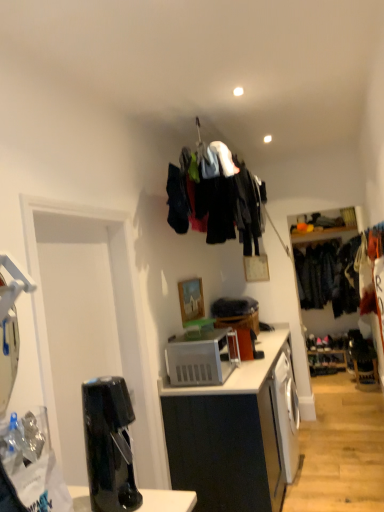
What do you see at coordinates (109, 445) in the screenshot?
I see `black glossy coffee machine at lower left` at bounding box center [109, 445].

At what (x,y) coordinates should I click in order to perform the action: click on black glossy coffee machine at lower left. Please return your answer as a coordinate pair (x, y). The height and width of the screenshot is (512, 384). Looking at the image, I should click on (109, 445).

At what (x,y) coordinates should I click in order to perform the action: click on wooden picture frame at center. Please return your answer as a coordinate pair (x, y). Image resolution: width=384 pixels, height=512 pixels. Looking at the image, I should click on (191, 298).

Describe the element at coordinates (236, 433) in the screenshot. I see `white matte cabinet at center` at that location.

Measure the distance between point (307, 267) and camera.

Point (307, 267) is 5.72 meters from camera.

What do you see at coordinates (215, 200) in the screenshot? I see `dark fabric clothes at upper center, placed as the 1th clothing when sorted from left to right` at bounding box center [215, 200].

Find the location of a particular element. This screenshot has height=512, width=384. white plastic microwave oven at center is located at coordinates (198, 358).

From the image's perspective, between wooden picture frame at center and white matte cabinet at center, who is located below?

white matte cabinet at center, from the image's perspective.

How different are the orientations of wooden picture frame at center and white matte cabinet at center in degrees?

There is a 0.329-degree angle between the facing directions of wooden picture frame at center and white matte cabinet at center.

Based on the photo, is wooden picture frame at center oriented towards white matte cabinet at center?

No, wooden picture frame at center is not turned towards white matte cabinet at center.

Considering the sizes of objects wooden picture frame at center and white matte cabinet at center in the image provided, who is wider, wooden picture frame at center or white matte cabinet at center?

Wider between the two is white matte cabinet at center.

Which is in front, white plastic microwave oven at center or wooden picture frame at center?

Positioned in front is white plastic microwave oven at center.

Where is `microwave oven in front of the wooden picture frame at center`? microwave oven in front of the wooden picture frame at center is located at coordinates (198, 358).

Based on their sizes in the image, would you say white plastic microwave oven at center is bigger or smaller than wooden picture frame at center?

white plastic microwave oven at center is bigger than wooden picture frame at center.

How much distance is there between white plastic microwave oven at center and wooden picture frame at center?

white plastic microwave oven at center is 19.91 inches from wooden picture frame at center.

Considering the positions of objects dark fabric clothes at upper center, placed as the 1th clothing when sorted from left to right, and black glossy coffee machine at lower left in the image provided, who is in front, dark fabric clothes at upper center, placed as the 1th clothing when sorted from left to right, or black glossy coffee machine at lower left?

black glossy coffee machine at lower left is more forward.

Considering the sizes of objects dark fabric clothes at upper center, which ranks as the second clothing in right-to-left order, and black glossy coffee machine at lower left in the image provided, who is wider, dark fabric clothes at upper center, which ranks as the second clothing in right-to-left order, or black glossy coffee machine at lower left?

dark fabric clothes at upper center, which ranks as the second clothing in right-to-left order.

Which is more to the right, dark fabric clothes at upper center, placed as the 1th clothing when sorted from left to right, or black glossy coffee machine at lower left?

Positioned to the right is dark fabric clothes at upper center, placed as the 1th clothing when sorted from left to right.

Is dark fabric clothes at upper center, which ranks as the second clothing in right-to-left order, outside of black glossy coffee machine at lower left?

Yes.

How different are the orientations of black glossy coffee machine at lower left and dark blue fabric at right, which is the first clothing from right to left, in degrees?

black glossy coffee machine at lower left and dark blue fabric at right, which is the first clothing from right to left, are facing 88.1 degrees away from each other.

Can you confirm if black glossy coffee machine at lower left is wider than dark blue fabric at right, the 2th clothing in the front-to-back sequence?

No.

In terms of size, does black glossy coffee machine at lower left appear bigger or smaller than dark blue fabric at right, the 2th clothing in the front-to-back sequence?

In the image, black glossy coffee machine at lower left appears to be smaller than dark blue fabric at right, the 2th clothing in the front-to-back sequence.

In terms of height, does dark blue fabric at right, the second clothing positioned from the left, look taller or shorter compared to wooden picture frame at center?

In the image, dark blue fabric at right, the second clothing positioned from the left, appears to be taller than wooden picture frame at center.

Is dark blue fabric at right, the second clothing positioned from the left, facing away from wooden picture frame at center?

dark blue fabric at right, the second clothing positioned from the left, does not have its back to wooden picture frame at center.

Considering the points (329, 258) and (195, 282), which point is behind, point (329, 258) or point (195, 282)?

The point (329, 258) is more distant.

Is dark blue fabric at right, which is the first clothing from right to left, to the right of wooden picture frame at center from the viewer's perspective?

→ Correct, you'll find dark blue fabric at right, which is the first clothing from right to left, to the right of wooden picture frame at center.

Looking at this image, from a real-world perspective, does white plastic microwave oven at center stand above dark blue fabric at right, the 2th clothing in the front-to-back sequence?

No, from a real-world perspective, white plastic microwave oven at center is not above dark blue fabric at right, the 2th clothing in the front-to-back sequence.

Is point (194, 358) closer to viewer compared to point (309, 287)?

Yes.

Looking at this image, considering the relative positions of white plastic microwave oven at center and dark blue fabric at right, the 2th clothing in the front-to-back sequence, in the image provided, is white plastic microwave oven at center in front of dark blue fabric at right, the 2th clothing in the front-to-back sequence,?

Yes, the depth of white plastic microwave oven at center is less than that of dark blue fabric at right, the 2th clothing in the front-to-back sequence.

From the image's perspective, between white plastic microwave oven at center and dark blue fabric at right, positioned as the first clothing in back-to-front order, who is located below?

white plastic microwave oven at center, from the image's perspective.

Can you confirm if black glossy coffee machine at lower left is bigger than dark fabric clothes at upper center, placed as the 1th clothing when sorted from left to right?

Actually, black glossy coffee machine at lower left might be smaller than dark fabric clothes at upper center, placed as the 1th clothing when sorted from left to right.

Considering the sizes of black glossy coffee machine at lower left and dark fabric clothes at upper center, positioned as the 2th clothing in back-to-front order, in the image, is black glossy coffee machine at lower left wider or thinner than dark fabric clothes at upper center, positioned as the 2th clothing in back-to-front order,?

In the image, black glossy coffee machine at lower left appears to be more narrow than dark fabric clothes at upper center, positioned as the 2th clothing in back-to-front order.

Measure the distance between black glossy coffee machine at lower left and dark fabric clothes at upper center, which is the first clothing from front to back.

A distance of 1.78 meters exists between black glossy coffee machine at lower left and dark fabric clothes at upper center, which is the first clothing from front to back.

Is the depth of black glossy coffee machine at lower left greater than that of dark fabric clothes at upper center, placed as the 1th clothing when sorted from left to right?

No, the depth of black glossy coffee machine at lower left is less than that of dark fabric clothes at upper center, placed as the 1th clothing when sorted from left to right.

Where is `cabinetry in front of the wooden picture frame at center`? cabinetry in front of the wooden picture frame at center is located at coordinates (236, 433).

Where is `picture frame above the white plastic microwave oven at center (from a real-world perspective)`? picture frame above the white plastic microwave oven at center (from a real-world perspective) is located at coordinates (191, 298).

Based on their spatial positions, is dark blue fabric at right, the second clothing positioned from the left, or black glossy coffee machine at lower left further from white plastic microwave oven at center?

Among the two, dark blue fabric at right, the second clothing positioned from the left, is located further to white plastic microwave oven at center.

Considering their positions, is white matte cabinet at center positioned further to dark fabric clothes at upper center, which is the first clothing from front to back, than white plastic microwave oven at center?

The object further to dark fabric clothes at upper center, which is the first clothing from front to back, is white matte cabinet at center.

When comparing their distances from white plastic microwave oven at center, does wooden picture frame at center or black glossy coffee machine at lower left seem further?

black glossy coffee machine at lower left.

Looking at the image, which one is located further to dark blue fabric at right, positioned as the first clothing in back-to-front order, white plastic microwave oven at center or wooden picture frame at center?

white plastic microwave oven at center is further to dark blue fabric at right, positioned as the first clothing in back-to-front order.

Based on their spatial positions, is black glossy coffee machine at lower left or dark fabric clothes at upper center, which ranks as the second clothing in right-to-left order, further from white matte cabinet at center?

Among the two, black glossy coffee machine at lower left is located further to white matte cabinet at center.

Based on their spatial positions, is white plastic microwave oven at center or dark blue fabric at right, positioned as the first clothing in back-to-front order, further from black glossy coffee machine at lower left?

dark blue fabric at right, positioned as the first clothing in back-to-front order, is positioned further to the anchor black glossy coffee machine at lower left.

When comparing their distances from wooden picture frame at center, does white matte cabinet at center or white plastic microwave oven at center seem closer?

white plastic microwave oven at center lies closer to wooden picture frame at center than the other object.

Based on their spatial positions, is dark blue fabric at right, which is the first clothing from right to left, or wooden picture frame at center closer to white matte cabinet at center?

Based on the image, wooden picture frame at center appears to be nearer to white matte cabinet at center.

What are the coordinates of `clothing located between black glossy coffee machine at lower left and dark blue fabric at right, which is the first clothing from right to left, in the depth direction` in the screenshot? It's located at (215, 200).

Where is `picture frame located between dark fabric clothes at upper center, positioned as the 2th clothing in back-to-front order, and dark blue fabric at right, the 2th clothing in the front-to-back sequence, in the depth direction`? This screenshot has width=384, height=512. picture frame located between dark fabric clothes at upper center, positioned as the 2th clothing in back-to-front order, and dark blue fabric at right, the 2th clothing in the front-to-back sequence, in the depth direction is located at coordinates [191, 298].

This screenshot has width=384, height=512. What are the coordinates of `microwave oven between black glossy coffee machine at lower left and dark blue fabric at right, which is the first clothing from right to left, along the z-axis` in the screenshot? It's located at (198, 358).

The height and width of the screenshot is (512, 384). Identify the location of clothing between black glossy coffee machine at lower left and white plastic microwave oven at center along the z-axis. (215, 200).